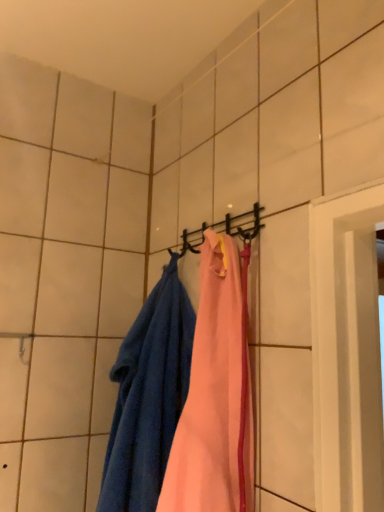
Question: Should I look upward or downward to see blue terry cloth towel at left?

Choices:
 (A) down
 (B) up

Answer: (A)

Question: Considering the relative sizes of metallic black hanger at center and blue terry cloth towel at left in the image provided, is metallic black hanger at center shorter than blue terry cloth towel at left?

Choices:
 (A) yes
 (B) no

Answer: (A)

Question: Is the position of metallic black hanger at center more distant than that of blue terry cloth towel at left?

Choices:
 (A) no
 (B) yes

Answer: (B)

Question: Is metallic black hanger at center next to blue terry cloth towel at left and touching it?

Choices:
 (A) yes
 (B) no

Answer: (B)

Question: From the image's perspective, is metallic black hanger at center over blue terry cloth towel at left?

Choices:
 (A) no
 (B) yes

Answer: (B)

Question: Does metallic black hanger at center come in front of blue terry cloth towel at left?

Choices:
 (A) no
 (B) yes

Answer: (A)

Question: Is metallic black hanger at center thinner than blue terry cloth towel at left?

Choices:
 (A) yes
 (B) no

Answer: (A)

Question: From a real-world perspective, is blue terry cloth towel at left on top of metallic black hanger at center?

Choices:
 (A) no
 (B) yes

Answer: (A)

Question: Is metallic black hanger at center surrounded by blue terry cloth towel at left?

Choices:
 (A) yes
 (B) no

Answer: (B)

Question: From the image's perspective, is blue terry cloth towel at left beneath metallic black hanger at center?

Choices:
 (A) yes
 (B) no

Answer: (A)

Question: Is blue terry cloth towel at left to the left of metallic black hanger at center from the viewer's perspective?

Choices:
 (A) yes
 (B) no

Answer: (A)

Question: Is blue terry cloth towel at left positioned before metallic black hanger at center?

Choices:
 (A) no
 (B) yes

Answer: (B)

Question: Is blue terry cloth towel at left located outside metallic black hanger at center?

Choices:
 (A) yes
 (B) no

Answer: (A)

Question: Based on their positions, is blue terry cloth towel at left located to the left or right of metallic black hanger at center?

Choices:
 (A) left
 (B) right

Answer: (A)